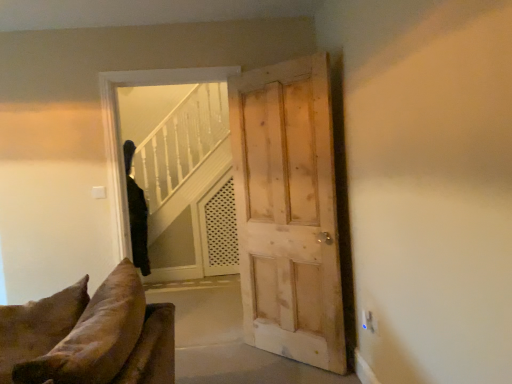
Question: From a real-world perspective, relative to transparent glass door at center, is light brown wooden door at center vertically above or below?

Choices:
 (A) below
 (B) above

Answer: (A)

Question: Is point (259, 317) closer or farther from the camera than point (182, 69)?

Choices:
 (A) closer
 (B) farther

Answer: (B)

Question: Considering the real-world distances, which object is farthest from the transparent glass door at center?

Choices:
 (A) light brown wooden door at center
 (B) black fabric coat at upper left

Answer: (B)

Question: Considering the real-world distances, which object is farthest from the transparent glass door at center?

Choices:
 (A) black fabric coat at upper left
 (B) light brown wooden door at center

Answer: (A)